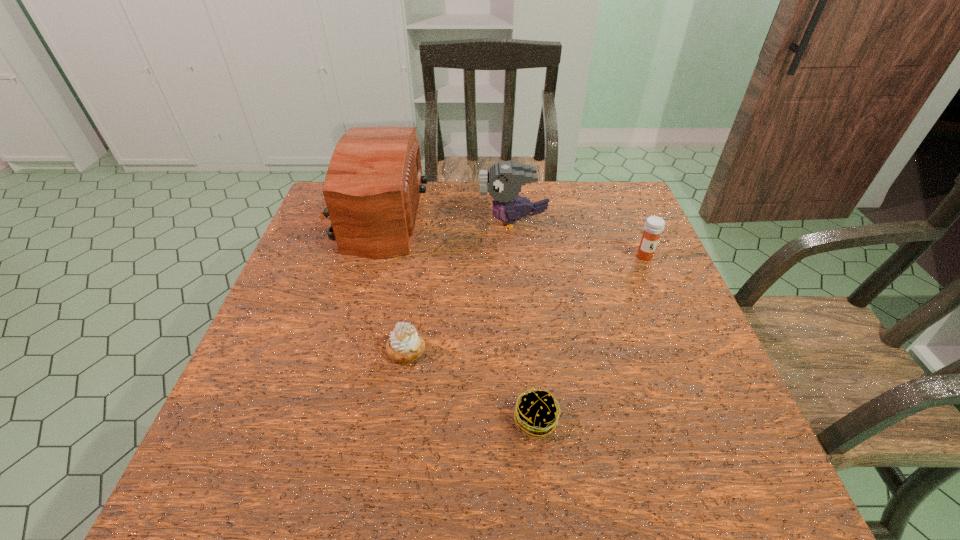
Image resolution: width=960 pixels, height=540 pixels. In order to click on free location located 0.360m on the label side of the medicine in this screenshot , I will do `click(696, 379)`.

Image resolution: width=960 pixels, height=540 pixels. Find the location of `free space located 0.260m on the right of the pastry`. free space located 0.260m on the right of the pastry is located at coordinates (546, 350).

Where is `free space located 0.060m on the left of the patty`? The height and width of the screenshot is (540, 960). free space located 0.060m on the left of the patty is located at coordinates (481, 420).

At what (x,y) coordinates should I click in order to perform the action: click on radio receiver that is at the far edge. Please return your answer as a coordinate pair (x, y). This screenshot has width=960, height=540. Looking at the image, I should click on (372, 188).

Identify the location of bird located at the far edge. The height and width of the screenshot is (540, 960). (503, 181).

Find the location of a particular element. The width and height of the screenshot is (960, 540). object located at the left edge is located at coordinates (372, 188).

At what (x,y) coordinates should I click in order to perform the action: click on object that is positioned at the right edge. Please return your answer as a coordinate pair (x, y). The image size is (960, 540). Looking at the image, I should click on (654, 225).

Locate an element on the screen. This screenshot has width=960, height=540. object that is at the far left corner is located at coordinates (372, 188).

You are a GUI agent. You are given a task and a screenshot of the screen. Output one action in this format:
    pyautogui.click(x=<x>, y=<y>)
    Task: Click on the vacant area at the far edge of the desktop
    
    Given the screenshot: What is the action you would take?
    pyautogui.click(x=543, y=196)

Where is `free space at the near edge of the desktop`? This screenshot has height=540, width=960. free space at the near edge of the desktop is located at coordinates (472, 461).